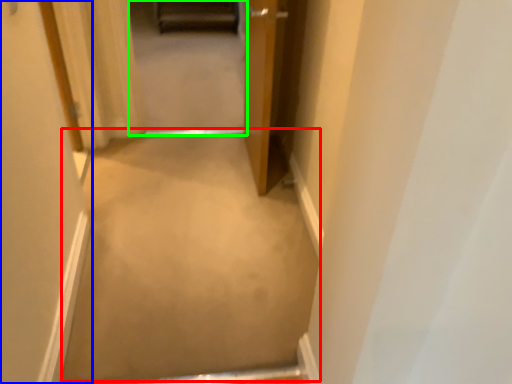
Question: Based on their relative distances, which object is farther from plain (highlighted by a red box)? Choose from door (highlighted by a blue box) and passage (highlighted by a green box).

Choices:
 (A) door
 (B) passage

Answer: (B)